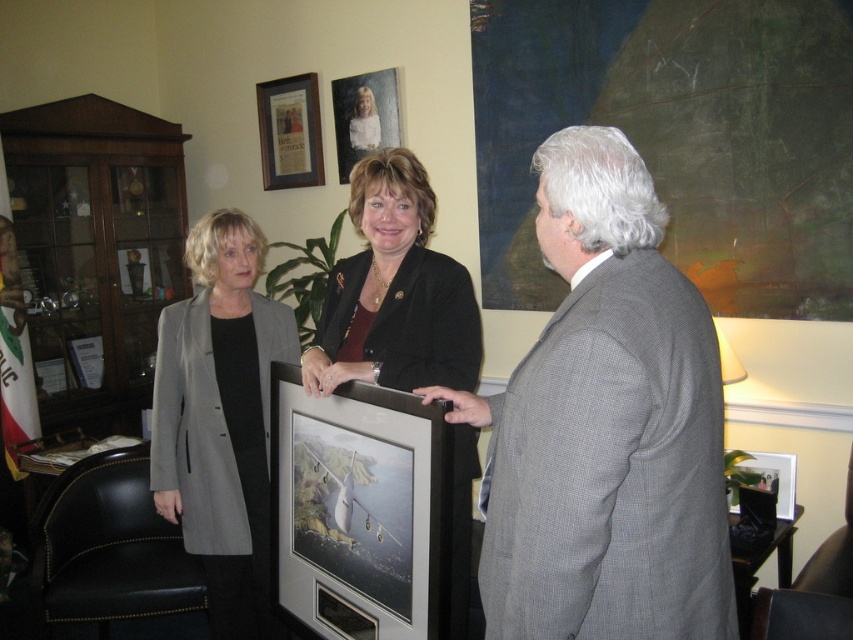
Who is lower down, matte black blazer at center or black matte blazer at center?

matte black blazer at center

Which is more to the right, matte black blazer at center or black matte blazer at center?

From the viewer's perspective, black matte blazer at center appears more on the right side.

Is point (376, 214) positioned in front of point (387, 384)?

No, (376, 214) is further to viewer.

At what (x,y) coordinates should I click in order to perform the action: click on matte black blazer at center. Please return your answer as a coordinate pair (x, y). Looking at the image, I should click on point(393,292).

Is point (403, 451) farther from camera compared to point (265, 172)?

No, (403, 451) is in front of (265, 172).

Is matte gray picture frame at center shorter than matte glass picture frame at upper center?

No.

Identify the location of matte gray picture frame at center. The image size is (853, 640). (358, 512).

Who is taller, metallic silver frame at upper center or metallic silver picture frame at center?

Standing taller between the two is metallic silver frame at upper center.

Does metallic silver frame at upper center come in front of metallic silver picture frame at center?

No, metallic silver frame at upper center is behind metallic silver picture frame at center.

Is point (390, 81) positioned behind point (735, 504)?

Yes, it is.

The width and height of the screenshot is (853, 640). I want to click on metallic silver frame at upper center, so click(x=364, y=116).